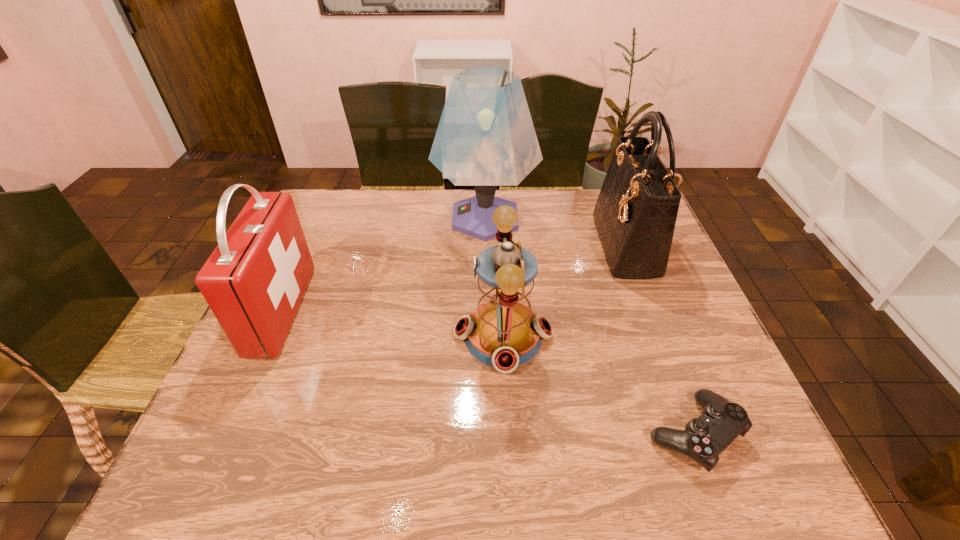
You are a GUI agent. You are given a task and a screenshot of the screen. Output one action in this format:
    pyautogui.click(x=<x>, y=<y>)
    Task: Click on the free space that is in between the second shortest object and the handbag
    Image resolution: width=960 pixels, height=540 pixels.
    Given the screenshot: What is the action you would take?
    pyautogui.click(x=564, y=291)

Identify the location of empty space that is in between the handbag and the shortest object. This screenshot has width=960, height=540. (660, 340).

I want to click on unoccupied position between the first-aid kit and the lantern, so click(393, 323).

Where is `blank region between the control and the leftmost object`? This screenshot has width=960, height=540. blank region between the control and the leftmost object is located at coordinates click(488, 372).

This screenshot has width=960, height=540. Identify the location of free point between the lantern and the handbag. (564, 291).

Identify the location of free space between the handbag and the leftmost object. (453, 278).

The height and width of the screenshot is (540, 960). I want to click on free space between the first-aid kit and the nearest object, so click(x=488, y=372).

The image size is (960, 540). I want to click on free space between the handbag and the lampshade, so click(x=555, y=232).

I want to click on free space between the leftmost object and the lampshade, so click(383, 264).

Find the location of a particular element. The height and width of the screenshot is (540, 960). object that is the closest to the handbag is located at coordinates (485, 138).